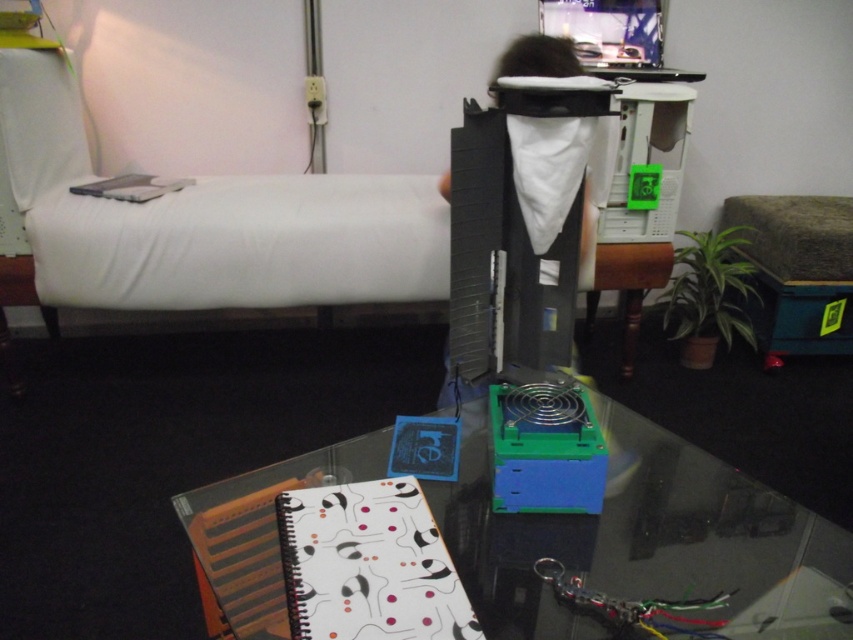
Question: Is transparent glass table at center smaller than matte white keyboard at left?

Choices:
 (A) no
 (B) yes

Answer: (A)

Question: Does transparent glass table at center appear on the right side of matte white keyboard at left?

Choices:
 (A) no
 (B) yes

Answer: (B)

Question: Considering the relative positions of transparent glass table at center and matte white keyboard at left in the image provided, where is transparent glass table at center located with respect to matte white keyboard at left?

Choices:
 (A) left
 (B) right

Answer: (B)

Question: Which object is closer to the camera taking this photo?

Choices:
 (A) transparent glass table at center
 (B) matte white keyboard at left

Answer: (A)

Question: Among these points, which one is nearest to the camera?

Choices:
 (A) (769, 577)
 (B) (107, 186)

Answer: (A)